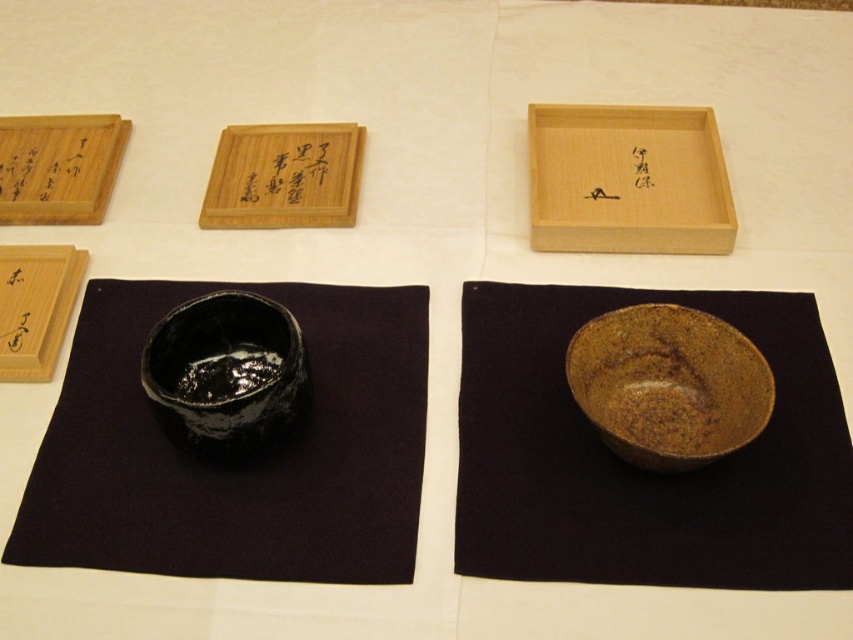
Is point (628, 120) positioned in front of point (235, 182)?

No, it is behind (235, 182).

Is the position of natural wood tray at upper center less distant than that of wooden tray at upper center?

Yes, it is in front of wooden tray at upper center.

Who is more distant from viewer, (709, 124) or (231, 157)?

Point (231, 157)

Find the location of `natural wood tray at upper center`. natural wood tray at upper center is located at coordinates (x=627, y=180).

Looking at this image, who is higher up, matte wood box at left or black wood writing at upper left?

Positioned higher is black wood writing at upper left.

The height and width of the screenshot is (640, 853). What do you see at coordinates (35, 307) in the screenshot?
I see `matte wood box at left` at bounding box center [35, 307].

What do you see at coordinates (35, 307) in the screenshot? I see `matte wood box at left` at bounding box center [35, 307].

The image size is (853, 640). Find the location of `matte wood box at left`. matte wood box at left is located at coordinates (35, 307).

Does brown textured bowl at lower right appear on the right side of matte wood box at upper left?

Correct, you'll find brown textured bowl at lower right to the right of matte wood box at upper left.

Who is more distant from viewer, (769, 369) or (41, 173)?

Positioned behind is point (41, 173).

Which is in front, point (691, 316) or point (0, 134)?

Positioned in front is point (691, 316).

I want to click on brown textured bowl at lower right, so click(668, 385).